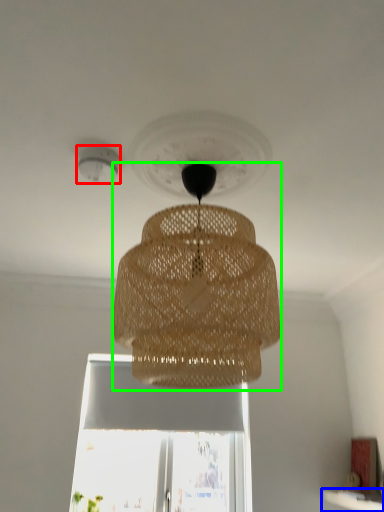
Question: Which object is positioned farthest from lighting (highlighted by a red box)? Select from window sill (highlighted by a blue box) and lamp (highlighted by a green box).

Choices:
 (A) window sill
 (B) lamp

Answer: (A)